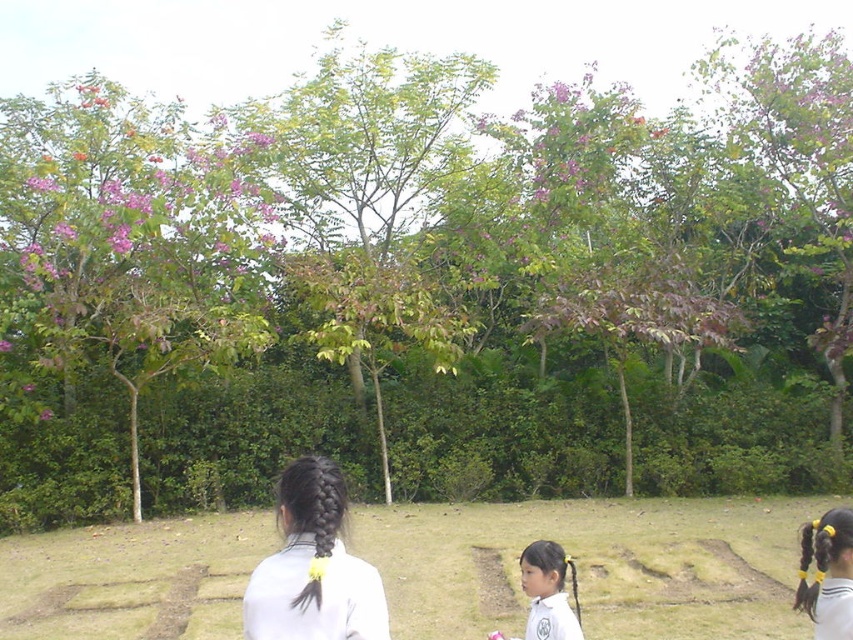
Question: Can you confirm if black hair at lower right is positioned above pink silky flower at upper left?

Choices:
 (A) no
 (B) yes

Answer: (A)

Question: Which point is farther to the camera?

Choices:
 (A) (415, 252)
 (B) (509, 637)

Answer: (A)

Question: Which of the following is the farthest from the observer?

Choices:
 (A) black hair at center
 (B) green leafy tree at center
 (C) light brown hair at lower center

Answer: (B)

Question: Is green leafy tree at center further to camera compared to light brown hair at lower center?

Choices:
 (A) no
 (B) yes

Answer: (B)

Question: Is black hair at center positioned at the back of black hair at lower right?

Choices:
 (A) yes
 (B) no

Answer: (B)

Question: Among these points, which one is nearest to the camera?

Choices:
 (A) (523, 586)
 (B) (202, 285)

Answer: (A)